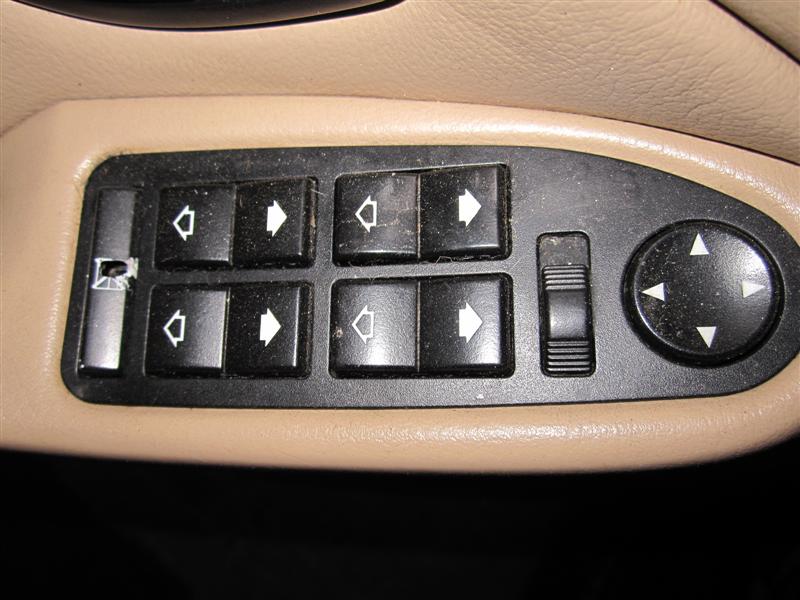
The height and width of the screenshot is (600, 800). What are the coordinates of `broken 'window lock' button` in the screenshot? It's located at (138, 197), (101, 193), (129, 248), (110, 272), (122, 346), (114, 372), (82, 370), (89, 308), (128, 278).